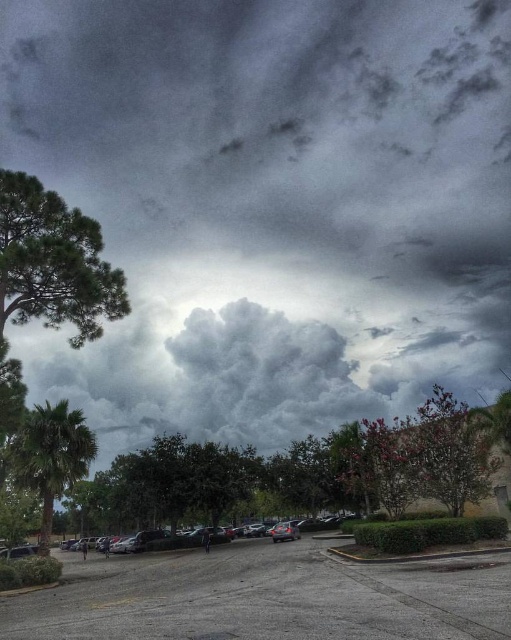
You are standing in the parking lot and looking up at the sky. Which object, the gray fluffy cloud at upper center or the gray asphalt parking lot at lower center, is closer to your eyes?

The gray fluffy cloud at upper center is closer to your eyes because the gray asphalt parking lot at lower center is behind it.

You are standing in the parking lot and want to walk towards the camera. Which point, point (x=179, y=636) or point (x=29, y=468), should you head towards?

You should head towards point (x=179, y=636) because it is closer to the camera than point (x=29, y=468).